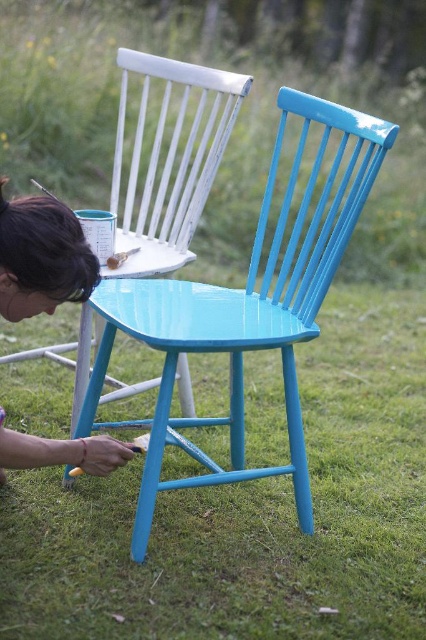
Between point (213, 480) and point (141, 250), which one is positioned behind?

Positioned behind is point (141, 250).

Between glossy wood chair at center and matte blue chair at center, which one is positioned lower?

glossy wood chair at center is below.

Which is in front, point (296, 224) or point (118, 61)?

Point (296, 224) is more forward.

This screenshot has width=426, height=640. What are the coordinates of `glossy wood chair at center` in the screenshot? It's located at (245, 308).

Who is positioned more to the right, matte blue chair at center or matte blue chair at lower left?

matte blue chair at center is more to the right.

Is matte blue chair at center positioned in front of matte blue chair at lower left?

No.

Is point (154, 141) behind point (48, 308)?

That is True.

Identify the location of matte blue chair at center. (169, 163).

Looking at this image, how much distance is there between glossy wood chair at center and matte blue chair at lower left?

A distance of 17.57 inches exists between glossy wood chair at center and matte blue chair at lower left.

Who is taller, glossy wood chair at center or matte blue chair at lower left?

glossy wood chair at center

Identify the location of glossy wood chair at center. (245, 308).